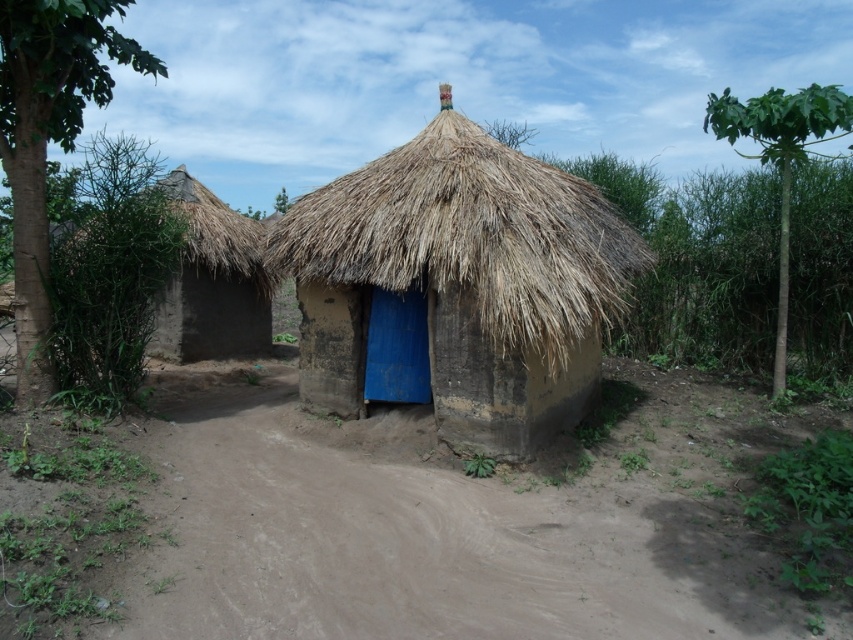
Locate an element on the screen. This screenshot has width=853, height=640. thatched mud hut at left is located at coordinates (212, 282).

Who is more forward, (186, 276) or (381, 337)?

Point (381, 337) is in front.

The height and width of the screenshot is (640, 853). I want to click on thatched mud hut at left, so click(212, 282).

How much distance is there between brown sandy dirt track at lower center and blue matte door at center?

The distance of brown sandy dirt track at lower center from blue matte door at center is 3.27 meters.

Is point (733, 628) more distant than point (421, 385)?

No, (733, 628) is in front of (421, 385).

Between point (692, 472) and point (409, 348), which one is positioned behind?

The point (409, 348) is behind.

This screenshot has width=853, height=640. Identify the location of brown sandy dirt track at lower center. (461, 525).

Does brown sandy dirt track at lower center appear on the right side of thatched mud hut at left?

Indeed, brown sandy dirt track at lower center is positioned on the right side of thatched mud hut at left.

Who is more distant from viewer, (735, 566) or (201, 252)?

The point (201, 252) is behind.

Find the location of `brown sandy dirt track at lower center`. brown sandy dirt track at lower center is located at coordinates click(x=461, y=525).